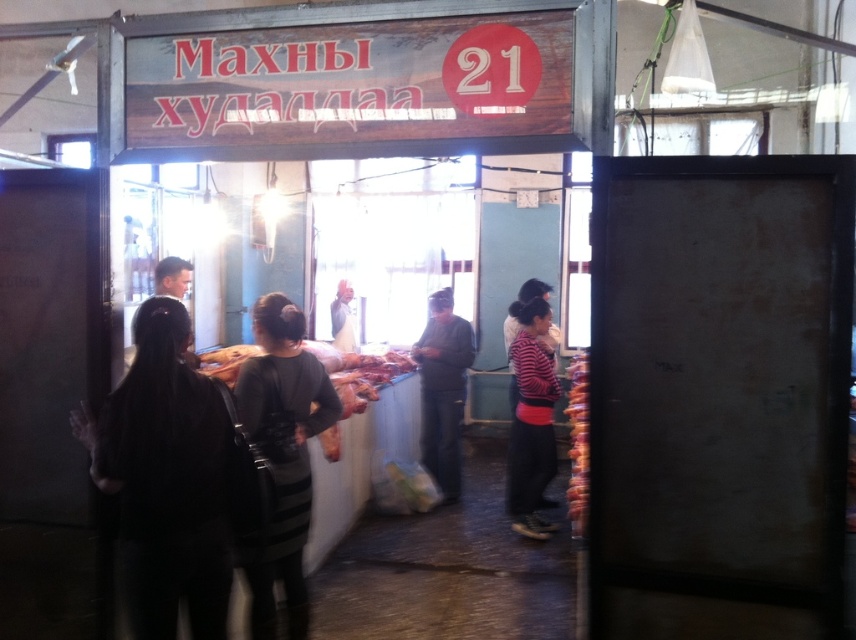
The width and height of the screenshot is (856, 640). What do you see at coordinates (531, 420) in the screenshot?
I see `striped knit sweater at center` at bounding box center [531, 420].

This screenshot has width=856, height=640. Describe the element at coordinates (531, 420) in the screenshot. I see `striped knit sweater at center` at that location.

Identify the location of striped knit sweater at center. (531, 420).

Does black fabric at left have a lesser width compared to raw meat at center?

Correct, black fabric at left's width is less than raw meat at center's.

Measure the distance between black fabric at left and raw meat at center.

black fabric at left is 6.69 feet away from raw meat at center.

Is point (169, 500) more distant than point (313, 352)?

No.

Find the location of a particular element. Image resolution: width=856 pixels, height=640 pixels. black fabric at left is located at coordinates (165, 480).

Can you confirm if black fabric at left is thinner than striped knit sweater at center?

Incorrect, black fabric at left's width is not less than striped knit sweater at center's.

Can you confirm if black fabric at left is taller than striped knit sweater at center?

Incorrect, black fabric at left's height is not larger of striped knit sweater at center's.

Measure the distance between point (x=158, y=336) and camera.

Point (x=158, y=336) is 2.53 meters from camera.

Find the location of a particular element. The height and width of the screenshot is (640, 856). black fabric at left is located at coordinates (165, 480).